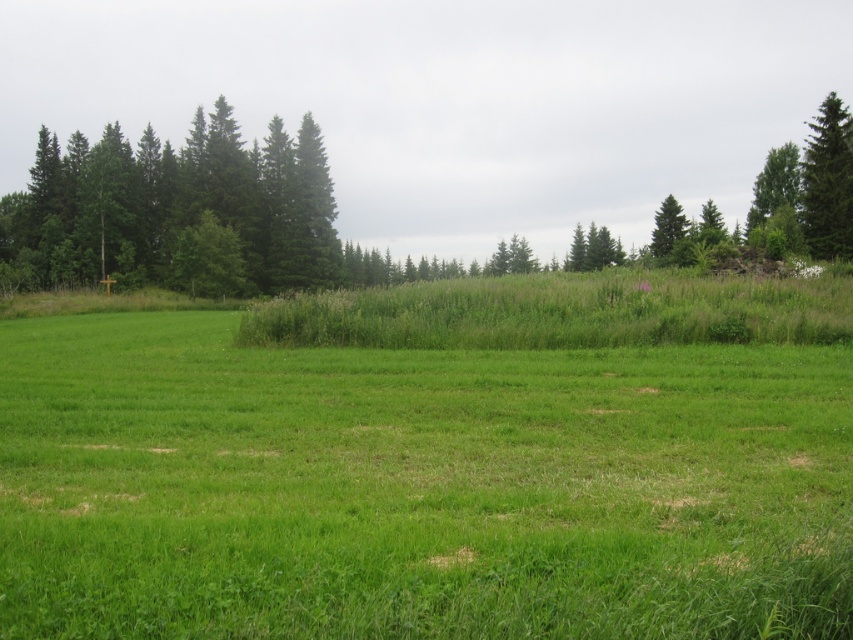
You are standing in the middle of the green grassland and see the green leafy tree at upper right and the green textured tree at upper right. Which tree is closer to the left side of your view?

The green leafy tree at upper right is closer to the left side of your view because it is positioned to the left of the green textured tree at upper right.

You are standing at the origin point of the coordinate system. You want to walk to the green grassy pasture at center. What direction should you walk in?

The green grassy pasture at center is located at coordinate point (415, 486), so you should walk towards the northeast direction to reach it.